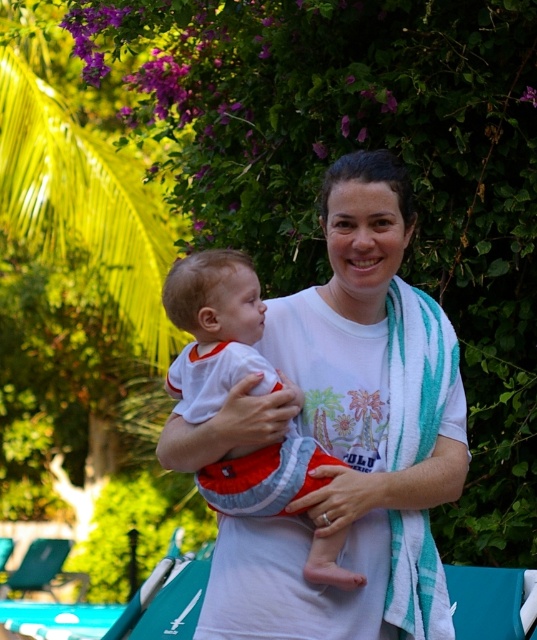
You are a photographer trying to capture the perfect shot of the white cotton shirt at center and the white cotton baby at center. Since you want to ensure both are in focus, you need to know which one is larger. Can you tell me which object is bigger?

The white cotton shirt at center is bigger than the white cotton baby at center, so you should focus on the shirt first as it occupies more space in the frame.

You are a photographer trying to capture a closeup of the white cotton shirt at center and the white cotton baby at center. The camera can only focus on objects within a 6 inch range. Will both subjects fit within the camera focus range?

The white cotton shirt at center and white cotton baby at center are 8.05 inches apart from each other, which exceeds the camera focus range of 6 inches. Therefore, both subjects cannot fit within the camera focus range.